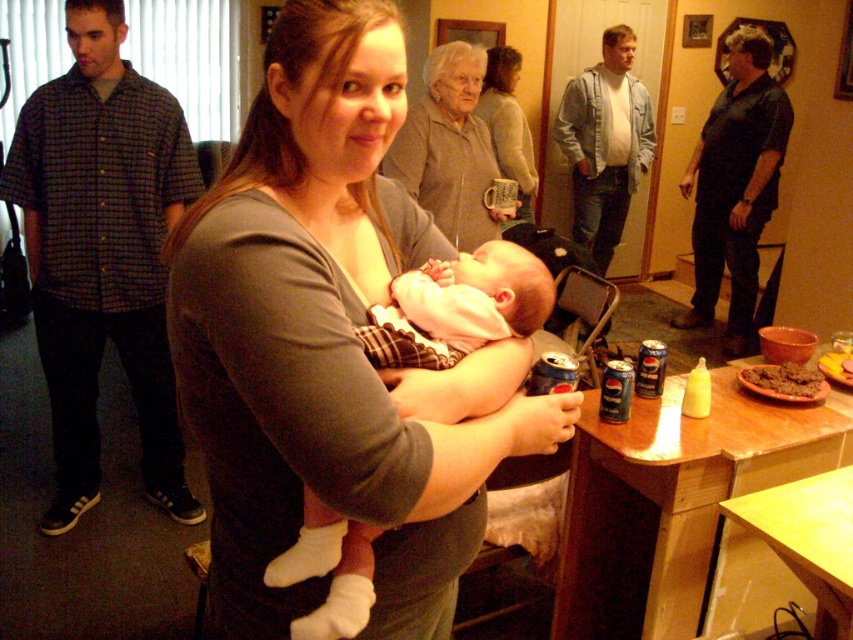
What do you see at coordinates (682, 513) in the screenshot? I see `wooden table at lower right` at bounding box center [682, 513].

Can you confirm if wooden table at lower right is taller than yellow wood table at lower right?

Yes, wooden table at lower right is taller than yellow wood table at lower right.

Find the location of a particular element. Image resolution: width=853 pixels, height=640 pixels. wooden table at lower right is located at coordinates (682, 513).

Identify the location of wooden table at lower right. This screenshot has height=640, width=853. (682, 513).

Measure the distance between white soft fabric baby at center and yellow wood table at lower right.

white soft fabric baby at center is 31.41 inches away from yellow wood table at lower right.

Does point (354, 600) come closer to viewer compared to point (798, 566)?

That is True.

Where is `white soft fabric baby at center`? Image resolution: width=853 pixels, height=640 pixels. white soft fabric baby at center is located at coordinates (457, 307).

Image resolution: width=853 pixels, height=640 pixels. Describe the element at coordinates (682, 513) in the screenshot. I see `wooden table at lower right` at that location.

Between wooden table at lower right and matte gray sweater at center, which one appears on the right side from the viewer's perspective?

wooden table at lower right is more to the right.

Image resolution: width=853 pixels, height=640 pixels. Identify the location of wooden table at lower right. (682, 513).

What are the coordinates of `wooden table at lower right` in the screenshot? It's located at (682, 513).